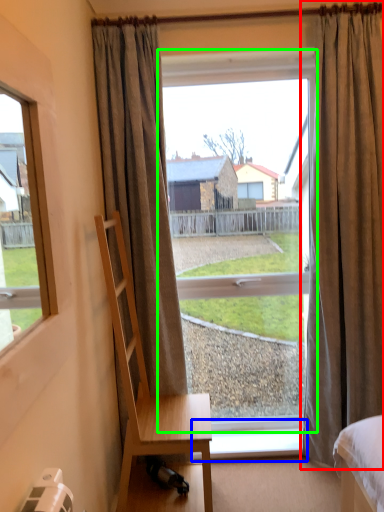
Question: Which is nearer to the curtain (highlighted by a red box)? window sill (highlighted by a blue box) or window (highlighted by a green box).

Choices:
 (A) window sill
 (B) window

Answer: (B)